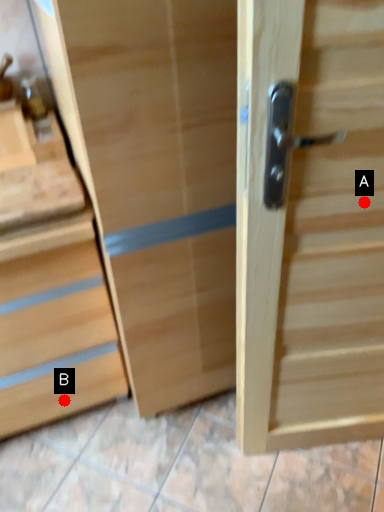
Question: Two points are circled on the image, labeled by A and B beside each circle. Which point appears closest to the camera in this image?

Choices:
 (A) A is closer
 (B) B is closer

Answer: (A)